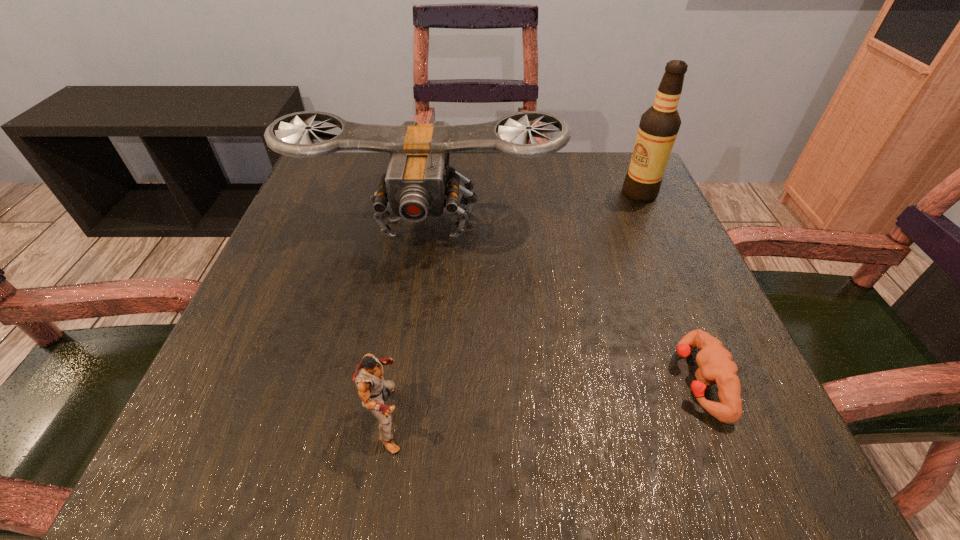
The height and width of the screenshot is (540, 960). What are the coordinates of `vacant space located 0.330m on the front-facing side of the left puncher` in the screenshot? It's located at (647, 418).

The image size is (960, 540). Find the location of `free space located with the gloves of the right puncher facing forward`. free space located with the gloves of the right puncher facing forward is located at coordinates (521, 380).

Find the location of a particular element. This screenshot has height=540, width=960. free space located with the gloves of the right puncher facing forward is located at coordinates pyautogui.click(x=515, y=380).

Find the location of a particular element. This screenshot has height=540, width=960. free region located 0.290m with the gloves of the right puncher facing forward is located at coordinates (481, 380).

Locate an element on the screen. The height and width of the screenshot is (540, 960). alcohol located in the far edge section of the desktop is located at coordinates (659, 125).

You are a GUI agent. You are given a task and a screenshot of the screen. Output one action in this format:
    pyautogui.click(x=<x>, y=<y>)
    Task: Click on the drone at the far edge
    This screenshot has width=960, height=540.
    Given the screenshot: What is the action you would take?
    pyautogui.click(x=419, y=183)

At what (x,y) coordinates should I click in order to perform the action: click on object located at the left edge. Please return your answer as a coordinate pair (x, y). The height and width of the screenshot is (540, 960). Looking at the image, I should click on (419, 183).

Where is `alcohol present at the right edge`? alcohol present at the right edge is located at coordinates (659, 125).

Locate an element on the screen. puncher that is positioned at the right edge is located at coordinates (716, 366).

In order to click on object positioned at the far left corner in this screenshot , I will do `click(419, 183)`.